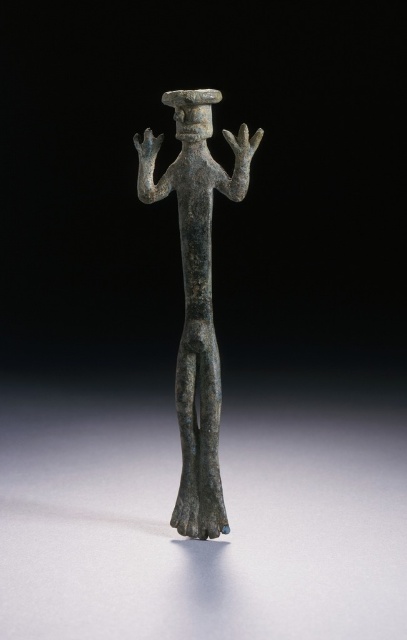
Between bronze statue at center and bronze textured hand at center, which one is positioned higher?

bronze textured hand at center is higher up.

Is point (203, 268) closer to camera compared to point (234, 156)?

No, (203, 268) is behind (234, 156).

Between point (205, 92) and point (249, 138), which one is positioned behind?

Positioned behind is point (205, 92).

What are the coordinates of `bronze statue at center` in the screenshot? It's located at (196, 307).

Does bronze textured hand at center have a smaller size compared to matte bronze hand at upper center?

Incorrect, bronze textured hand at center is not smaller in size than matte bronze hand at upper center.

Between bronze textured hand at center and matte bronze hand at upper center, which one is positioned lower?

bronze textured hand at center

Is point (229, 140) in front of point (137, 141)?

Yes, it is in front of point (137, 141).

Identify the location of bronze textured hand at center. (242, 144).

Who is higher up, bronze statue at center or matte bronze hand at upper center?

matte bronze hand at upper center is higher up.

Does bronze statue at center have a smaller size compared to matte bronze hand at upper center?

No.

The height and width of the screenshot is (640, 407). What do you see at coordinates (196, 307) in the screenshot?
I see `bronze statue at center` at bounding box center [196, 307].

Locate an element on the screen. bronze statue at center is located at coordinates (196, 307).